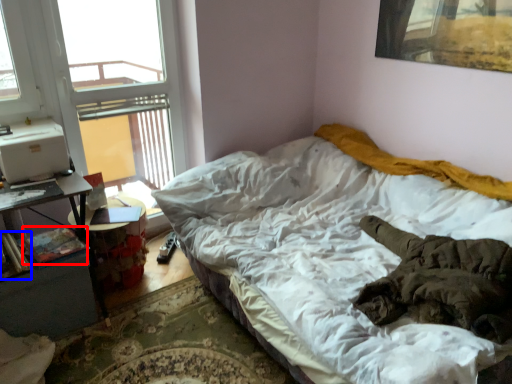
Question: Which object appears farthest to the camera in this image, book (highlighted by a red box) or book (highlighted by a blue box)?

Choices:
 (A) book
 (B) book

Answer: (A)